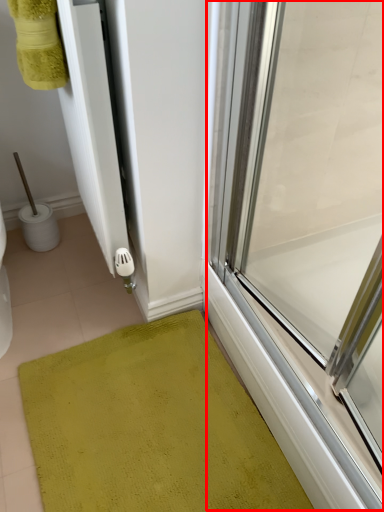
Question: Observing the image, what is the correct spatial positioning of glass door (annotated by the red box) in reference to bath mat?

Choices:
 (A) left
 (B) right

Answer: (B)